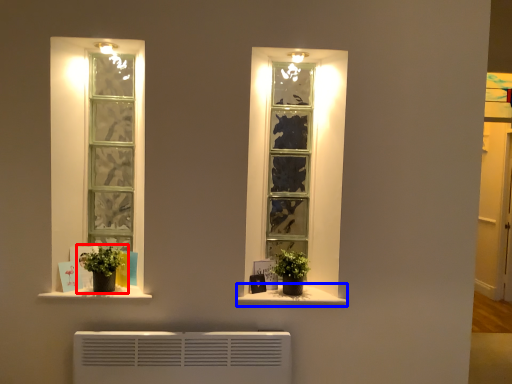
Question: Which object is further to the camera taking this photo, houseplant (highlighted by a red box) or window sill (highlighted by a blue box)?

Choices:
 (A) houseplant
 (B) window sill

Answer: (B)